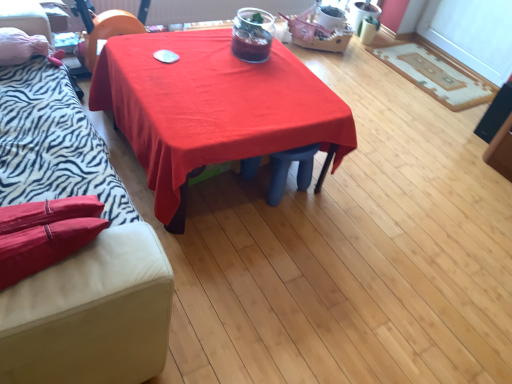
The width and height of the screenshot is (512, 384). I want to click on vacant space in beige textured rug at right (from a real-world perspective), so click(x=428, y=76).